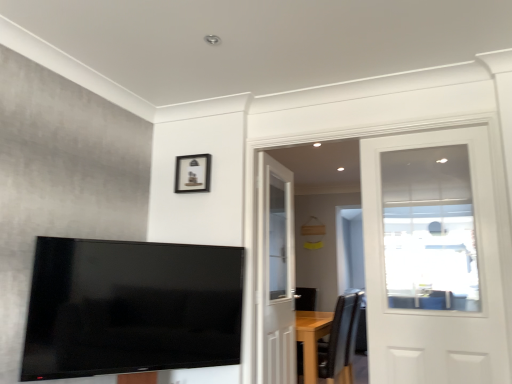
The image size is (512, 384). In order to click on vacant space situated above white glossy door at upper right, the second door when ordered from left to right (from a real-world perspective) in this screenshot , I will do `click(419, 124)`.